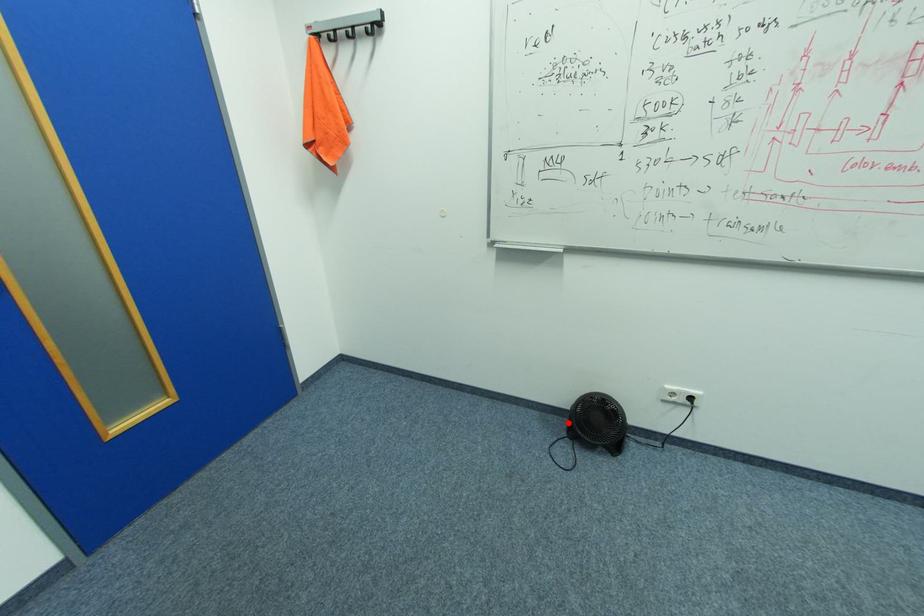
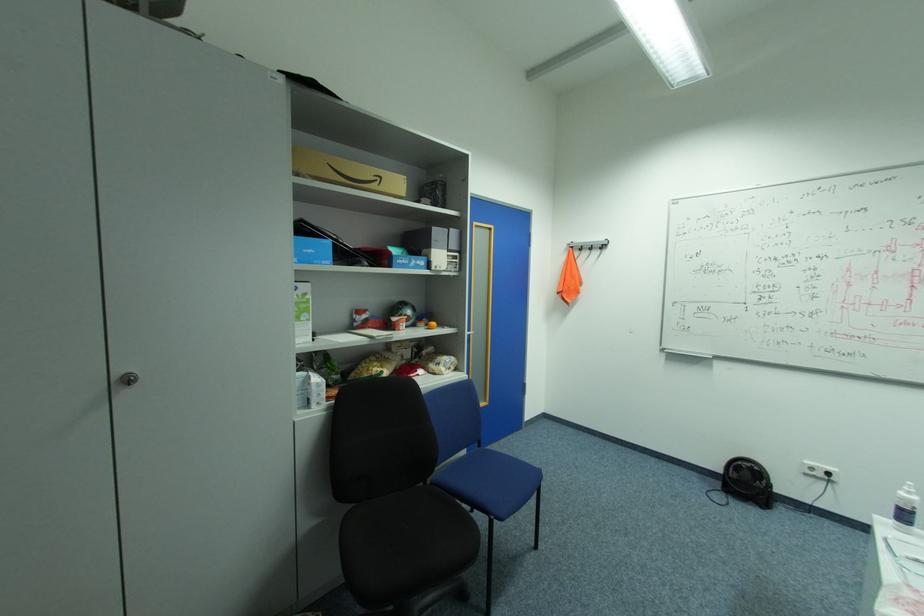
In the second image, find the point that corresponds to the highlighted location in the first image.

(724, 484)